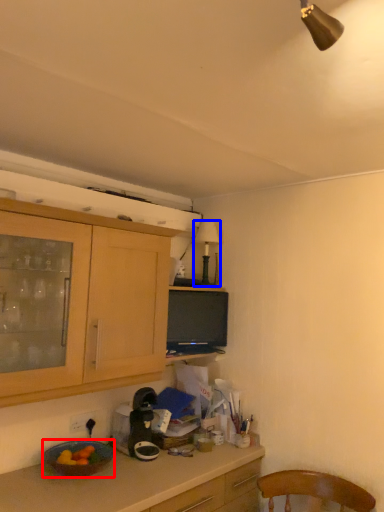
Question: Which of the following is the farthest to the observer, bowl (highlighted by a red box) or lamp (highlighted by a blue box)?

Choices:
 (A) bowl
 (B) lamp

Answer: (B)